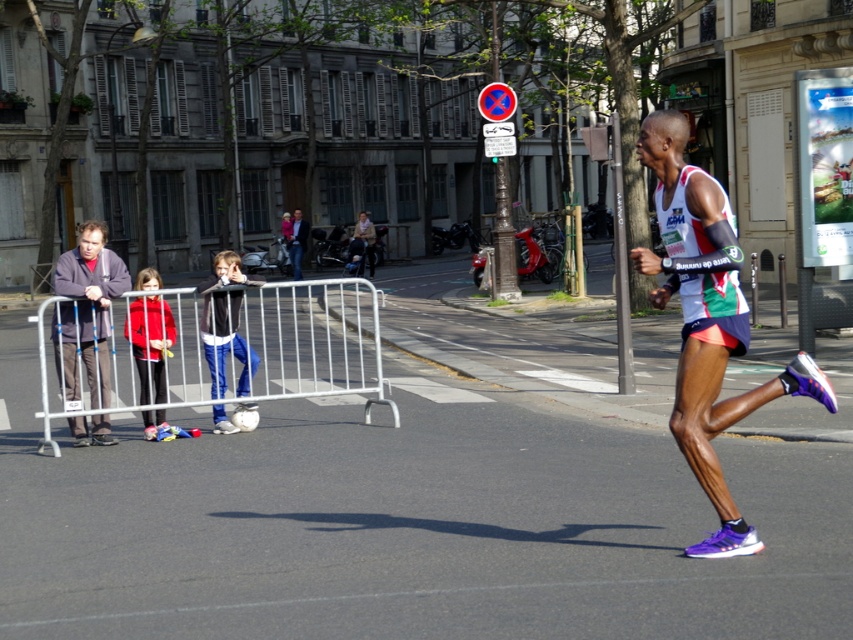
Who is more distant from viewer, (38, 449) or (206, 310)?

The point (206, 310) is more distant.

Is silver metallic barricade at left behind blue jeans at center?

No, it is not.

Is point (247, 339) more distant than point (218, 323)?

Yes, point (247, 339) is behind point (218, 323).

Locate an element on the screen. The height and width of the screenshot is (640, 853). silver metallic barricade at left is located at coordinates (218, 348).

Is point (155, 292) in front of point (294, 275)?

Yes, point (155, 292) is in front of point (294, 275).

What are the coordinates of `silver metallic barricade at left` in the screenshot? It's located at (218, 348).

Find the location of `silver metallic barricade at left`. silver metallic barricade at left is located at coordinates (218, 348).

Between blue jeans at center and red fleece jacket at left, which one has less height?

red fleece jacket at left is shorter.

Does blue jeans at center have a lesser width compared to red fleece jacket at left?

In fact, blue jeans at center might be wider than red fleece jacket at left.

Between point (253, 356) and point (154, 364), which one is positioned behind?

The point (253, 356) is more distant.

Locate an element on the screen. Image resolution: width=853 pixels, height=640 pixels. blue jeans at center is located at coordinates (225, 323).